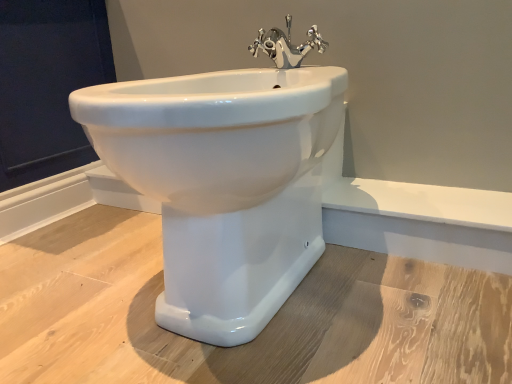
Question: Would you say chrome metallic faucet at upper center contains white glossy bidet at center?

Choices:
 (A) yes
 (B) no

Answer: (B)

Question: Considering the relative positions of chrome metallic faucet at upper center and white glossy bidet at center in the image provided, is chrome metallic faucet at upper center to the right of white glossy bidet at center from the viewer's perspective?

Choices:
 (A) no
 (B) yes

Answer: (B)

Question: Considering the relative positions of chrome metallic faucet at upper center and white glossy bidet at center in the image provided, is chrome metallic faucet at upper center to the left of white glossy bidet at center from the viewer's perspective?

Choices:
 (A) yes
 (B) no

Answer: (B)

Question: Considering the relative sizes of chrome metallic faucet at upper center and white glossy bidet at center in the image provided, is chrome metallic faucet at upper center smaller than white glossy bidet at center?

Choices:
 (A) yes
 (B) no

Answer: (A)

Question: Is chrome metallic faucet at upper center oriented away from white glossy bidet at center?

Choices:
 (A) yes
 (B) no

Answer: (B)

Question: Does chrome metallic faucet at upper center have a lesser height compared to white glossy bidet at center?

Choices:
 (A) no
 (B) yes

Answer: (B)

Question: Is chrome metallic faucet at upper center to the right of dark blue fabric at upper left from the viewer's perspective?

Choices:
 (A) no
 (B) yes

Answer: (B)

Question: Does chrome metallic faucet at upper center have a lesser width compared to dark blue fabric at upper left?

Choices:
 (A) yes
 (B) no

Answer: (A)

Question: Is chrome metallic faucet at upper center bigger than dark blue fabric at upper left?

Choices:
 (A) no
 (B) yes

Answer: (A)

Question: Is chrome metallic faucet at upper center outside dark blue fabric at upper left?

Choices:
 (A) no
 (B) yes

Answer: (B)

Question: Is chrome metallic faucet at upper center oriented away from dark blue fabric at upper left?

Choices:
 (A) no
 (B) yes

Answer: (A)

Question: Is chrome metallic faucet at upper center positioned far away from dark blue fabric at upper left?

Choices:
 (A) yes
 (B) no

Answer: (B)

Question: Is dark blue fabric at upper left closer to the viewer compared to chrome metallic faucet at upper center?

Choices:
 (A) yes
 (B) no

Answer: (B)